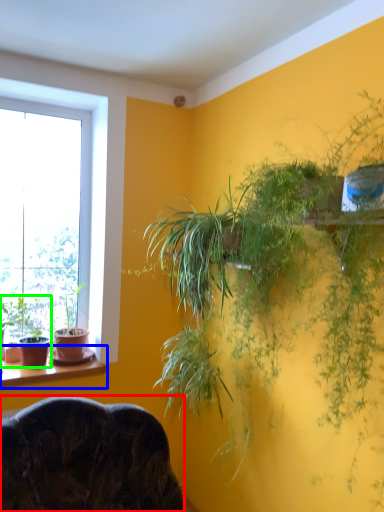
Question: Which object is positioned closest to furniture (highlighted by a red box)? Select from window sill (highlighted by a blue box) and houseplant (highlighted by a green box).

Choices:
 (A) window sill
 (B) houseplant

Answer: (A)